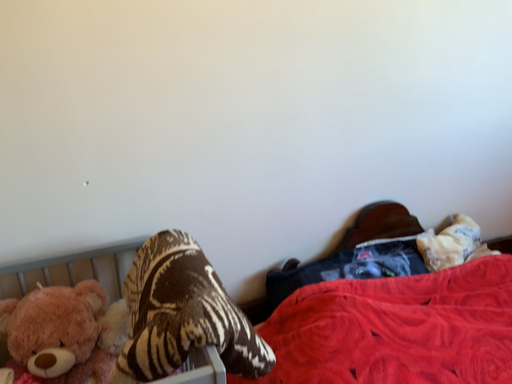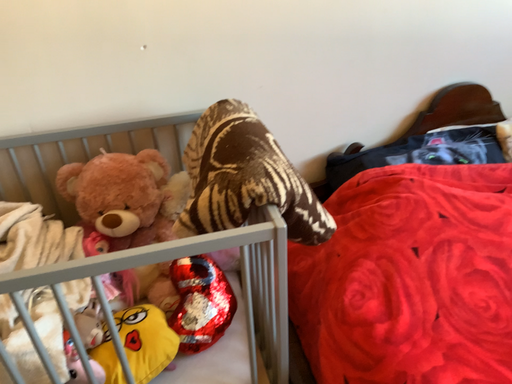
Question: Which way did the camera rotate in the video?

Choices:
 (A) rotated right
 (B) rotated left

Answer: (B)